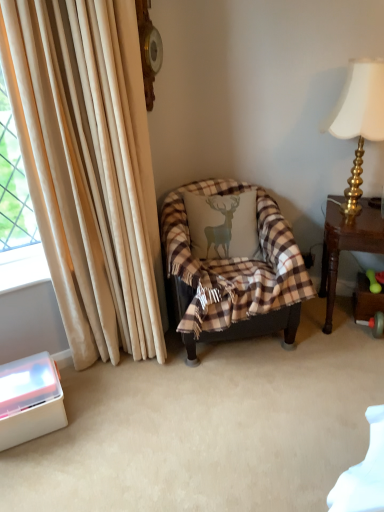
What do you see at coordinates (89, 169) in the screenshot? I see `beige velvet curtain at left` at bounding box center [89, 169].

The width and height of the screenshot is (384, 512). In order to click on plaid fabric pillow with deer design at center in this screenshot , I will do `click(223, 225)`.

The height and width of the screenshot is (512, 384). What are the coordinates of `white plastic container at lower left` in the screenshot? It's located at (30, 401).

Is gold metallic lampshade at upper right wider than white plastic container at lower left?

In fact, gold metallic lampshade at upper right might be narrower than white plastic container at lower left.

At what (x,y) coordinates should I click in order to perform the action: click on lamp in front of the white plastic container at lower left. Please return your answer as a coordinate pair (x, y). Image resolution: width=384 pixels, height=512 pixels. Looking at the image, I should click on (359, 120).

Where is `chair behind the beige velvet curtain at left`? The height and width of the screenshot is (512, 384). chair behind the beige velvet curtain at left is located at coordinates (234, 273).

In the scene shown: Is beige velvet curtain at left bigger than plaid fabric chair at center?

Actually, beige velvet curtain at left might be smaller than plaid fabric chair at center.

Could you tell me if beige velvet curtain at left is facing plaid fabric chair at center?

No, beige velvet curtain at left is not facing towards plaid fabric chair at center.

Is the position of beige velvet curtain at left more distant than that of plaid fabric chair at center?

No, beige velvet curtain at left is closer to the camera.

From the image's perspective, is brown wooden table at right located beneath plaid fabric chair at center?

Indeed, from the image's perspective, brown wooden table at right is shown beneath plaid fabric chair at center.

Considering the positions of objects brown wooden table at right and plaid fabric chair at center in the image provided, who is in front, brown wooden table at right or plaid fabric chair at center?

plaid fabric chair at center is more forward.

Is brown wooden table at right oriented towards plaid fabric chair at center?

No, brown wooden table at right is not aimed at plaid fabric chair at center.

Would you say brown wooden table at right is a long distance from plaid fabric chair at center?

brown wooden table at right is near plaid fabric chair at center, not far away.

Does point (45, 388) appear closer or farther from the camera than point (329, 294)?

Clearly, point (45, 388) is closer to the camera than point (329, 294).

From the picture: Considering the relative sizes of white plastic container at lower left and brown wooden table at right in the image provided, is white plastic container at lower left wider than brown wooden table at right?

In fact, white plastic container at lower left might be narrower than brown wooden table at right.

Between white plastic container at lower left and brown wooden table at right, which one has less height?

white plastic container at lower left is shorter.

From a real-world perspective, relative to brown wooden table at right, is white plastic container at lower left vertically above or below?

white plastic container at lower left is below brown wooden table at right.

Relative to brown wooden table at right, is plaid fabric pillow with deer design at center in front or behind?

plaid fabric pillow with deer design at center is positioned farther from the viewer than brown wooden table at right.

Does plaid fabric pillow with deer design at center turn towards brown wooden table at right?

No, plaid fabric pillow with deer design at center is not oriented towards brown wooden table at right.

Is plaid fabric pillow with deer design at center next to brown wooden table at right?

No, plaid fabric pillow with deer design at center is not next to brown wooden table at right.

Considering the relative positions of plaid fabric pillow with deer design at center and brown wooden table at right in the image provided, is plaid fabric pillow with deer design at center to the right of brown wooden table at right from the viewer's perspective?

In fact, plaid fabric pillow with deer design at center is to the left of brown wooden table at right.

Can we say white plastic container at lower left lies outside beige velvet curtain at left?

Absolutely, white plastic container at lower left is external to beige velvet curtain at left.

Is white plastic container at lower left turned away from beige velvet curtain at left?

No, white plastic container at lower left's orientation is not away from beige velvet curtain at left.

From a real-world perspective, which is physically below, white plastic container at lower left or beige velvet curtain at left?

white plastic container at lower left is physically lower.

From the image's perspective, relative to plaid fabric pillow with deer design at center, is beige velvet curtain at left above or below?

Based on their image positions, beige velvet curtain at left is located above plaid fabric pillow with deer design at center.

Does beige velvet curtain at left lie behind plaid fabric pillow with deer design at center?

That is False.

Which of these two, beige velvet curtain at left or plaid fabric pillow with deer design at center, stands shorter?

plaid fabric pillow with deer design at center is shorter.

Is beige velvet curtain at left positioned far away from plaid fabric pillow with deer design at center?

That's not correct — beige velvet curtain at left is a little close to plaid fabric pillow with deer design at center.

This screenshot has height=512, width=384. What are the coordinates of `box on the left of gold metallic lampshade at upper right` in the screenshot? It's located at (30, 401).

At what (x,y) coordinates should I click in order to perform the action: click on chair on the right of beige velvet curtain at left. Please return your answer as a coordinate pair (x, y). The image size is (384, 512). Looking at the image, I should click on (234, 273).

Looking at the image, which one is located further to white plastic container at lower left, plaid fabric pillow with deer design at center or gold metallic lampshade at upper right?

Based on the image, gold metallic lampshade at upper right appears to be further to white plastic container at lower left.

Which object lies further to the anchor point plaid fabric pillow with deer design at center, brown wooden table at right or plaid fabric chair at center?

Among the two, brown wooden table at right is located further to plaid fabric pillow with deer design at center.

Considering their positions, is white plastic container at lower left positioned further to gold metallic lampshade at upper right than plaid fabric pillow with deer design at center?

white plastic container at lower left is positioned further to the anchor gold metallic lampshade at upper right.

Which object lies nearer to the anchor point beige velvet curtain at left, plaid fabric chair at center or brown wooden table at right?

The object closer to beige velvet curtain at left is plaid fabric chair at center.

Based on the photo, considering their positions, is beige velvet curtain at left positioned further to white plastic container at lower left than plaid fabric chair at center?

plaid fabric chair at center lies further to white plastic container at lower left than the other object.

Looking at the image, which one is located closer to brown wooden table at right, plaid fabric chair at center or gold metallic lampshade at upper right?

gold metallic lampshade at upper right is positioned closer to the anchor brown wooden table at right.

Based on their spatial positions, is brown wooden table at right or plaid fabric pillow with deer design at center further from gold metallic lampshade at upper right?

plaid fabric pillow with deer design at center is further to gold metallic lampshade at upper right.

Estimate the real-world distances between objects in this image. Which object is closer to brown wooden table at right, plaid fabric pillow with deer design at center or plaid fabric chair at center?

Based on the image, plaid fabric chair at center appears to be nearer to brown wooden table at right.

Identify the location of curtain between white plastic container at lower left and gold metallic lampshade at upper right from left to right. The height and width of the screenshot is (512, 384). (89, 169).

You are a GUI agent. You are given a task and a screenshot of the screen. Output one action in this format:
    pyautogui.click(x=<x>, y=<y>)
    Task: Click on the pillow situated between white plastic container at lower left and gold metallic lampshade at upper right from left to right
    Image resolution: width=384 pixels, height=512 pixels.
    Given the screenshot: What is the action you would take?
    pyautogui.click(x=223, y=225)

What are the coordinates of `lamp located between plaid fabric chair at center and brown wooden table at right in the left-right direction` in the screenshot? It's located at (359, 120).

Identify the location of chair situated between plaid fabric pillow with deer design at center and brown wooden table at right from left to right. The width and height of the screenshot is (384, 512). (234, 273).